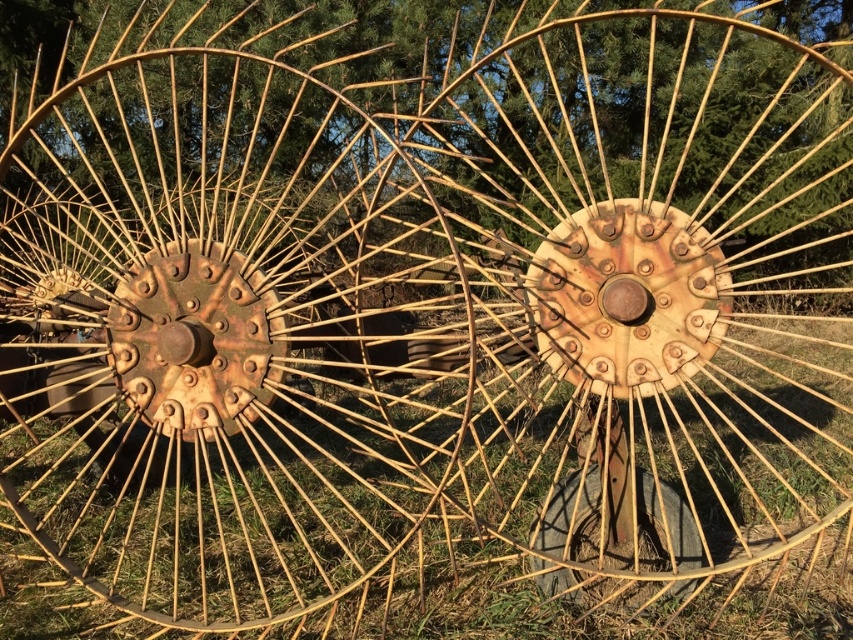
Question: Observing the image, what is the correct spatial positioning of rusty metallic spokes at center in reference to rusty metal tire at center?

Choices:
 (A) above
 (B) below

Answer: (A)

Question: Which object is farther from the camera taking this photo?

Choices:
 (A) rusty metallic spokes at center
 (B) rusty metal wagon wheel at center

Answer: (A)

Question: Estimate the real-world distances between objects in this image. Which object is closer to the rusty metal wagon wheel at center?

Choices:
 (A) rusty metal tire at center
 (B) rusty metallic spokes at center

Answer: (B)

Question: Is rusty metallic spokes at center positioned at the back of rusty metal wagon wheel at center?

Choices:
 (A) yes
 (B) no

Answer: (A)

Question: Can you confirm if rusty metal wagon wheel at center is thinner than rusty metal tire at center?

Choices:
 (A) no
 (B) yes

Answer: (A)

Question: Which object is closer to the camera taking this photo?

Choices:
 (A) rusty metallic spokes at center
 (B) rusty metal tire at center
 (C) rusty metal wagon wheel at center

Answer: (C)